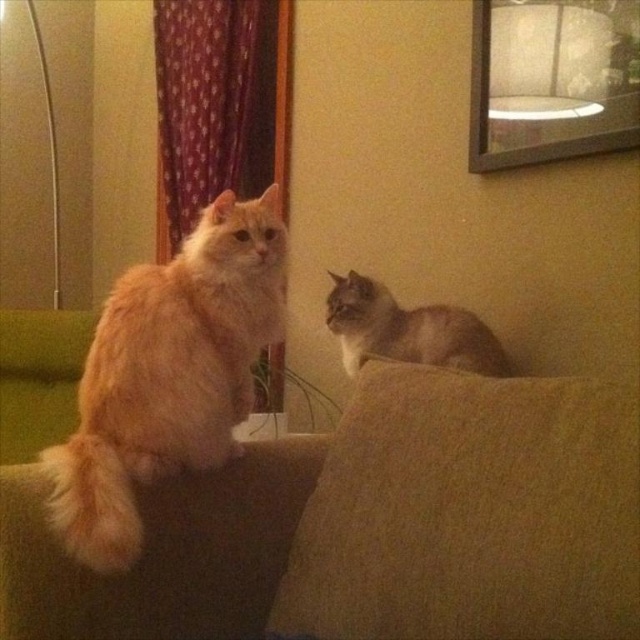
Question: Among these points, which one is nearest to the camera?

Choices:
 (A) (241, 88)
 (B) (211, 282)
 (C) (406, 360)

Answer: (B)

Question: Is brown fabric couch at center further to camera compared to fluffy orange cat at left?

Choices:
 (A) no
 (B) yes

Answer: (A)

Question: Can you confirm if brown fabric couch at center is bigger than silvery-gray fur cat at upper right?

Choices:
 (A) yes
 (B) no

Answer: (A)

Question: Is red velvet curtain at upper left thinner than silvery-gray fur cat at upper right?

Choices:
 (A) yes
 (B) no

Answer: (B)

Question: Estimate the real-world distances between objects in this image. Which object is closer to the fluffy orange cat at left?

Choices:
 (A) silvery-gray fur cat at upper right
 (B) brown fabric couch at center

Answer: (B)

Question: Based on their relative distances, which object is nearer to the fluffy orange cat at left?

Choices:
 (A) silvery-gray fur cat at upper right
 (B) red velvet curtain at upper left
 (C) brown fabric couch at center

Answer: (C)